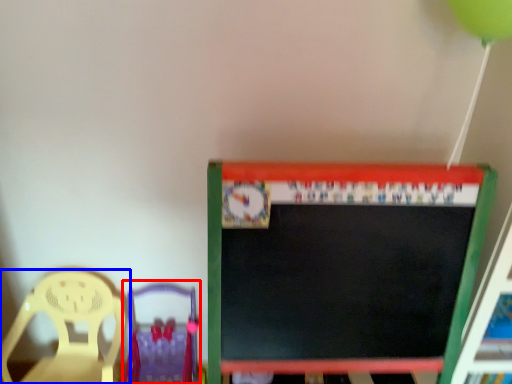
Question: Which object appears farthest to the camera in this image, chair (highlighted by a red box) or chair (highlighted by a blue box)?

Choices:
 (A) chair
 (B) chair

Answer: (A)